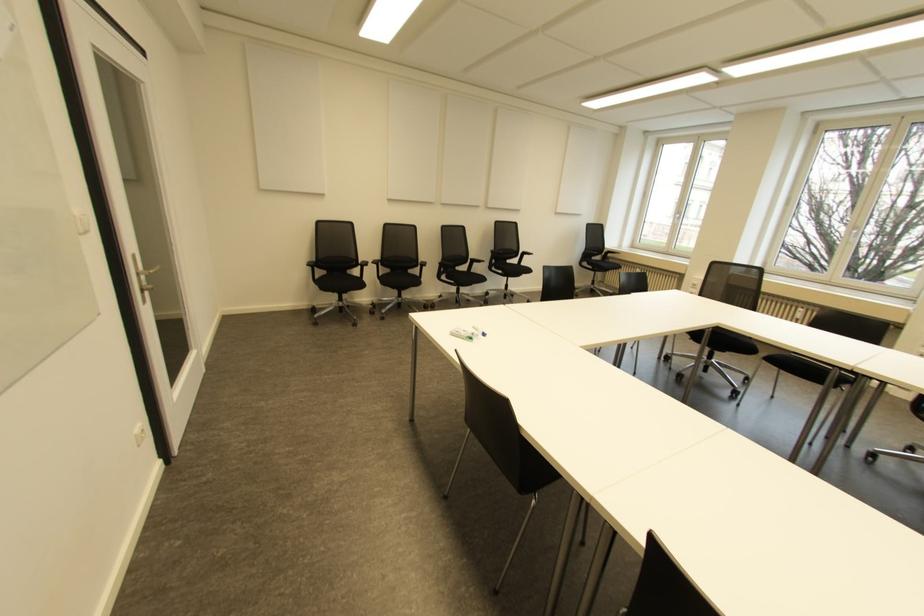
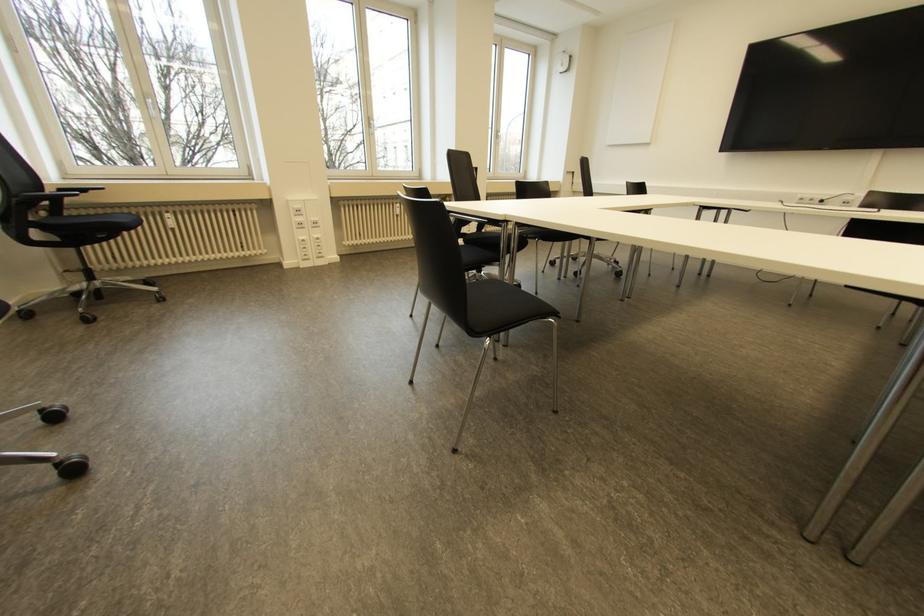
Where in the second image is the point corresponding to [800,309] from the first image?

(397, 204)